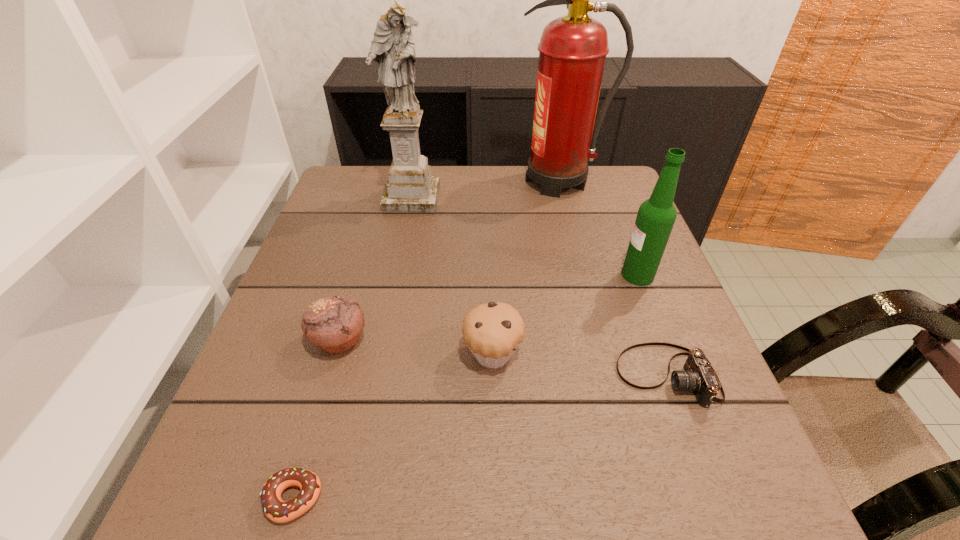
You are a GUI agent. You are given a task and a screenshot of the screen. Output one action in this format:
    pyautogui.click(x=<x>, y=<y>)
    Task: Click on the vacant space located 0.120m on the front-facing side of the camera
    
    Given the screenshot: What is the action you would take?
    pyautogui.click(x=551, y=376)

Identify the location of vacant area situated 0.140m on the right of the shortest object. Image resolution: width=960 pixels, height=540 pixels. (419, 498).

Locate an element on the screen. This screenshot has width=960, height=540. fire extinguisher that is at the far edge is located at coordinates (572, 51).

Locate an element on the screen. Image resolution: width=960 pixels, height=540 pixels. sculpture at the far edge is located at coordinates (410, 187).

You are a GUI agent. You are given a task and a screenshot of the screen. Output one action in this format:
    pyautogui.click(x=<x>, y=<y>)
    Task: Click on the object at the near edge
    The width and height of the screenshot is (960, 540).
    Given the screenshot: What is the action you would take?
    pyautogui.click(x=277, y=510)

What are the coordinates of `sculpture present at the left edge` in the screenshot? It's located at 410,187.

Locate an element on the screen. muffin located in the left edge section of the desktop is located at coordinates (334, 324).

You are a GUI agent. You are given a task and a screenshot of the screen. Output one action in this format:
    pyautogui.click(x=<x>, y=<y>)
    Task: Click on the doughnut situated at the left edge
    This screenshot has height=540, width=960.
    Given the screenshot: What is the action you would take?
    pyautogui.click(x=277, y=510)

Where is `fire extinguisher present at the right edge`? fire extinguisher present at the right edge is located at coordinates (572, 51).

Where is `beer bottle located in the right edge section of the desktop`? beer bottle located in the right edge section of the desktop is located at coordinates (656, 216).